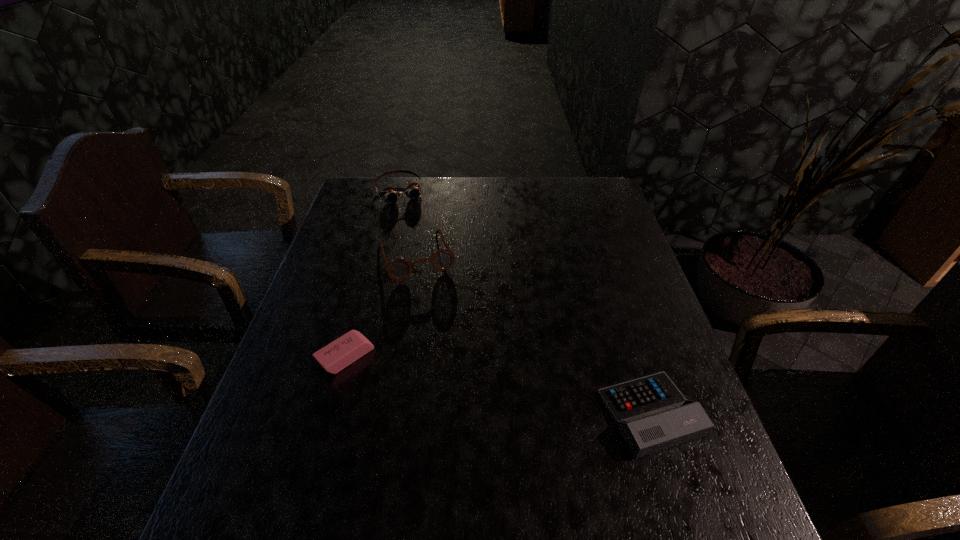
In order to click on eraser in this screenshot , I will do `click(337, 355)`.

At what (x,y) coordinates should I click in order to perform the action: click on calculator. Please return your answer as a coordinate pair (x, y). The height and width of the screenshot is (540, 960). Looking at the image, I should click on (651, 413).

You are a GUI agent. You are given a task and a screenshot of the screen. Output one action in this format:
    pyautogui.click(x=<x>, y=<y>)
    Task: Click on the tallest object
    
    Given the screenshot: What is the action you would take?
    pyautogui.click(x=398, y=269)

What are the coordinates of `the second farthest object` in the screenshot? It's located at (398, 269).

At what (x,y) coordinates should I click in order to perform the action: click on the second tallest object. Please return your answer as a coordinate pair (x, y). Looking at the image, I should click on (391, 195).

Locate an element on the screen. The image size is (960, 540). the farthest object is located at coordinates click(x=391, y=195).

Image resolution: width=960 pixels, height=540 pixels. Find the location of `vacant space situated 0.100m on the right of the eraser`. vacant space situated 0.100m on the right of the eraser is located at coordinates (416, 357).

At what (x,y) coordinates should I click in order to perform the action: click on vacant space located on the back of the rightmost object. Please return your answer as a coordinate pair (x, y). The width and height of the screenshot is (960, 540). Looking at the image, I should click on (615, 304).

The width and height of the screenshot is (960, 540). Identify the location of vacant space located on the front-facing side of the tallest object. (461, 373).

Where is `free location located 0.190m on the front-facing side of the tallest object`? free location located 0.190m on the front-facing side of the tallest object is located at coordinates (444, 331).